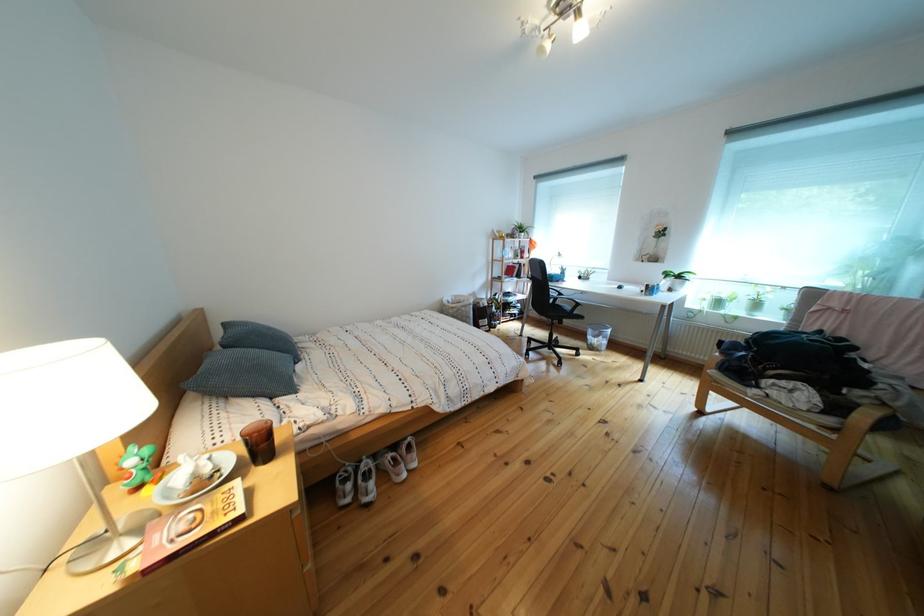
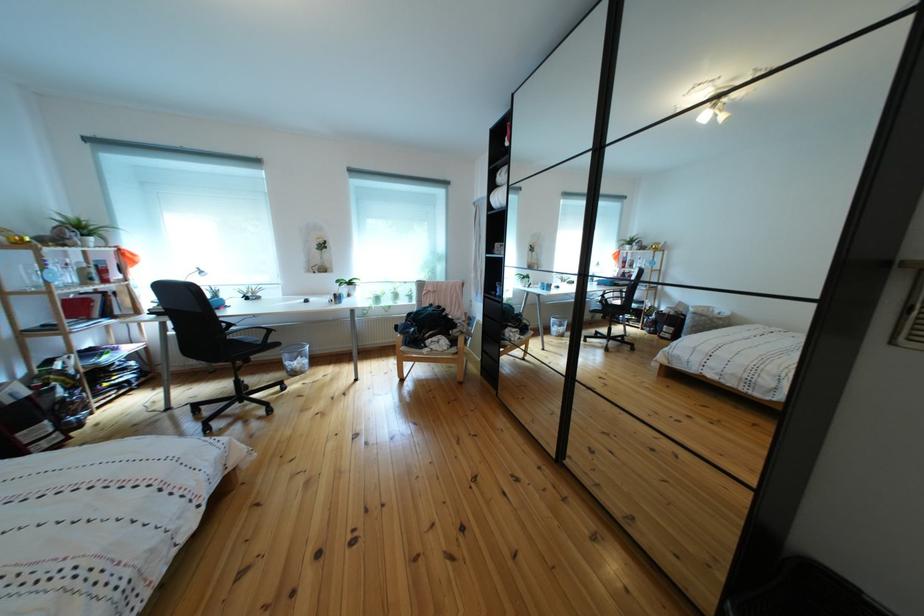
Locate, in the second image, the point that corresponds to pixel 678 281 in the first image.

(351, 288)